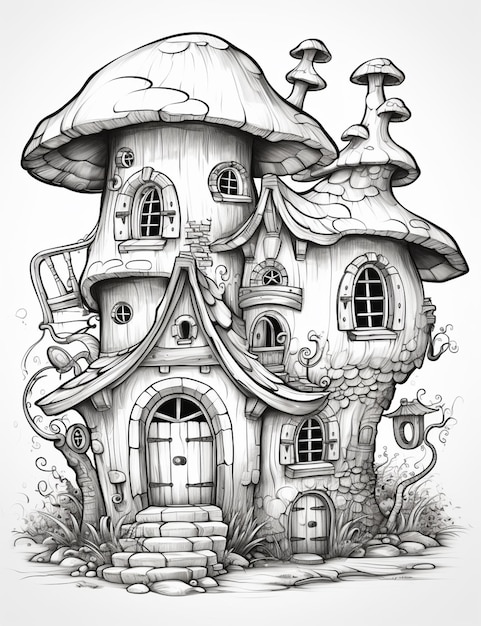
The height and width of the screenshot is (626, 481). Identify the location of door. (192, 453), (307, 529).